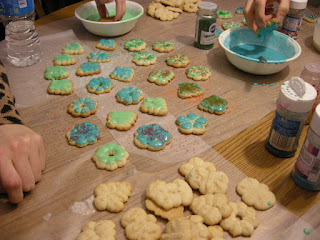
This screenshot has width=320, height=240. In order to click on spoon handle in this screenshot , I will do `click(262, 60)`.